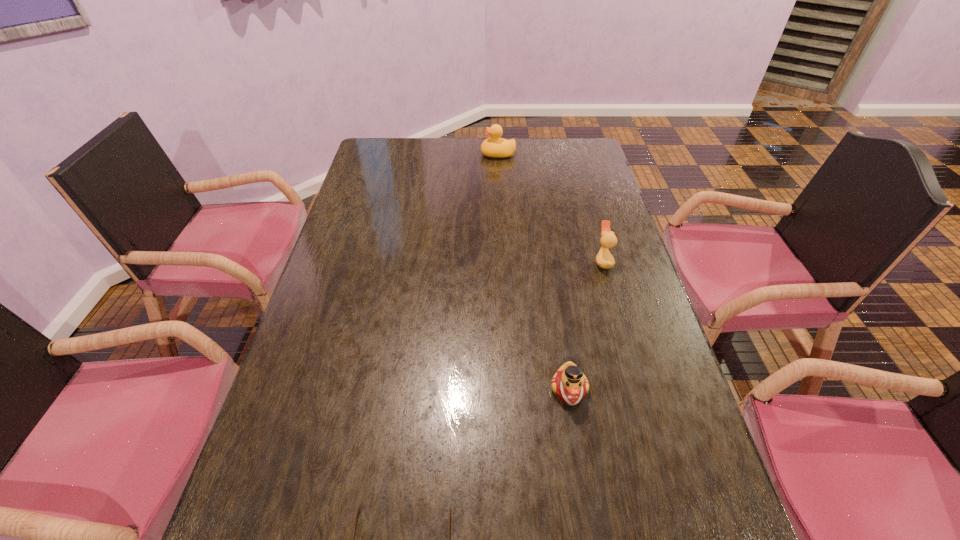
Find the location of a particular element. The height and width of the screenshot is (540, 960). free space located 0.190m on the beak of the rightmost object is located at coordinates (529, 261).

Where is `free space located on the beak of the rightmost object`? Image resolution: width=960 pixels, height=540 pixels. free space located on the beak of the rightmost object is located at coordinates (492, 261).

The image size is (960, 540). In order to click on vacant area situated on the face of the third tallest object in this screenshot , I will do `click(587, 496)`.

I want to click on object present at the far edge, so click(x=496, y=147).

You are a GUI agent. You are given a task and a screenshot of the screen. Output one action in this format:
    pyautogui.click(x=<x>, y=<y>)
    Task: Click on the object situated at the right edge
    
    Given the screenshot: What is the action you would take?
    pyautogui.click(x=604, y=259)

The height and width of the screenshot is (540, 960). Find the location of `free space at the left edge`. free space at the left edge is located at coordinates (300, 488).

I want to click on blank space at the right edge, so click(589, 278).

At what (x,y) coordinates should I click in order to perform the action: click on free space at the far left corner of the desktop. Please return your answer as a coordinate pair (x, y). Image resolution: width=960 pixels, height=540 pixels. Looking at the image, I should click on (390, 155).

What are the coordinates of `blank region between the second farthest duck and the nearest duck` in the screenshot? It's located at (586, 326).

Find the location of a particular element. vacant area that lies between the third farthest object and the second farthest duck is located at coordinates (586, 326).